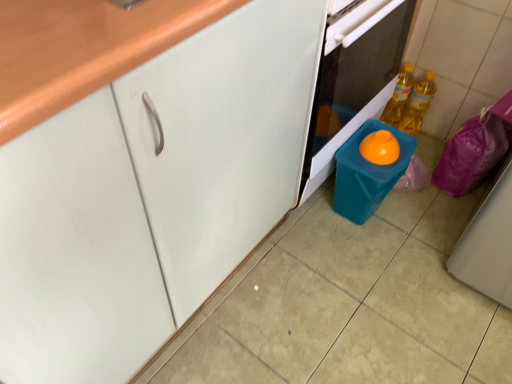
This screenshot has width=512, height=384. I want to click on vacant space to the left of teal plastic container at lower right, so click(310, 222).